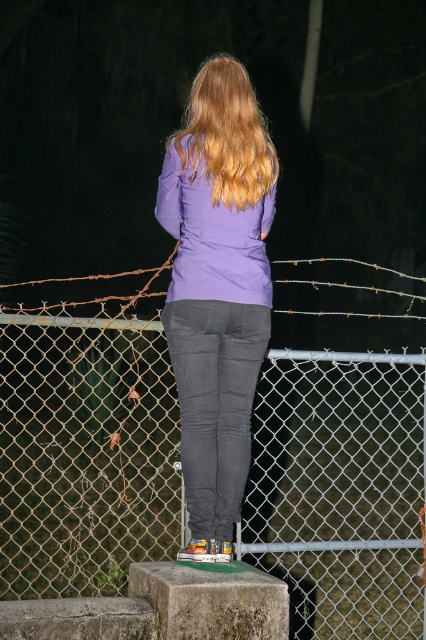
Can you confirm if wire mesh fence at center is taller than purple matte jacket at center?

No, wire mesh fence at center is not taller than purple matte jacket at center.

Measure the distance between point [287,544] and camera.

6.13 meters

The width and height of the screenshot is (426, 640). What are the coordinates of `wire mesh fence at center` in the screenshot? It's located at (85, 451).

Who is positioned more to the right, purple matte jacket at center or golden wavy hair at back?

Positioned to the right is golden wavy hair at back.

Who is lower down, purple matte jacket at center or golden wavy hair at back?

purple matte jacket at center is below.

What are the coordinates of `purple matte jacket at center` in the screenshot? It's located at (216, 291).

Image resolution: width=426 pixels, height=640 pixels. I want to click on purple matte jacket at center, so click(216, 291).

Between wire mesh fence at center and golden wavy hair at back, which one has less height?

wire mesh fence at center is shorter.

Is point (414, 436) farther from viewer compared to point (255, 99)?

Yes, point (414, 436) is farther from viewer.

You are a GUI agent. You are given a task and a screenshot of the screen. Output one action in this format:
    pyautogui.click(x=<x>, y=<y>)
    Task: Click on the wire mesh fence at center
    
    Given the screenshot: What is the action you would take?
    pyautogui.click(x=85, y=451)